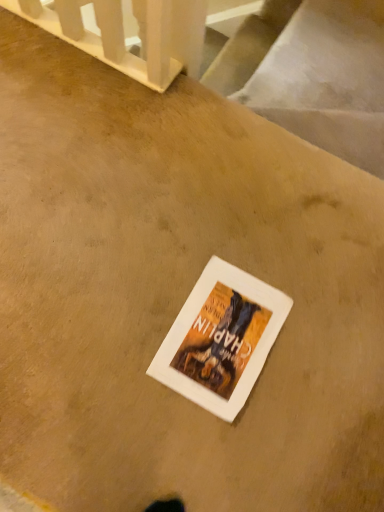
Locate an element on the screen. free point to the left of white paper book at center is located at coordinates (120, 307).